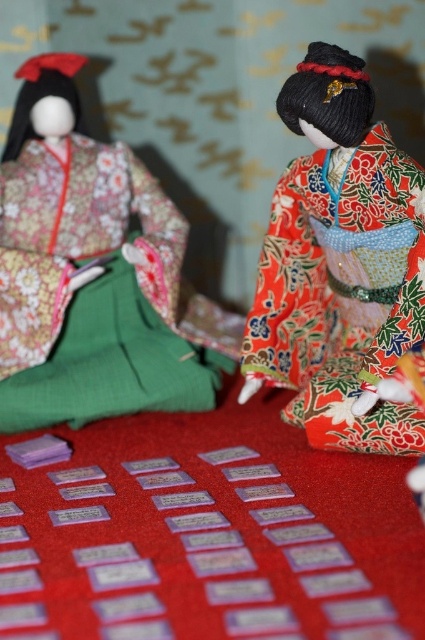
Between matte floral kimono at left and shiny red kimono at right, which one has less height?

shiny red kimono at right is shorter.

Does matte floral kimono at left have a greater height compared to shiny red kimono at right?

Yes.

The image size is (425, 640). I want to click on matte floral kimono at left, so click(x=93, y=275).